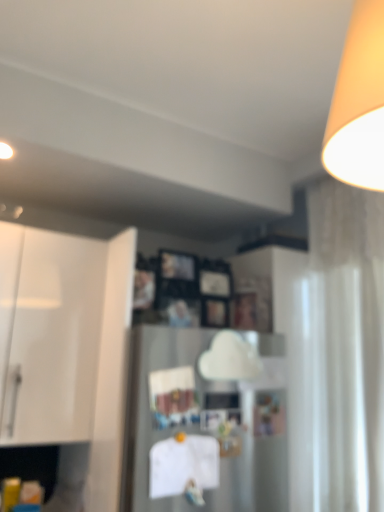
Question: From the image's perspective, is white sheer curtain at right on top of satin silver refrigerator at center?

Choices:
 (A) no
 (B) yes

Answer: (B)

Question: Is the depth of white sheer curtain at right less than that of satin silver refrigerator at center?

Choices:
 (A) no
 (B) yes

Answer: (A)

Question: Does white sheer curtain at right come behind satin silver refrigerator at center?

Choices:
 (A) yes
 (B) no

Answer: (A)

Question: From the image's perspective, is white sheer curtain at right beneath satin silver refrigerator at center?

Choices:
 (A) yes
 (B) no

Answer: (B)

Question: Is white sheer curtain at right looking in the opposite direction of satin silver refrigerator at center?

Choices:
 (A) no
 (B) yes

Answer: (A)

Question: Is white sheer curtain at right facing towards satin silver refrigerator at center?

Choices:
 (A) yes
 (B) no

Answer: (A)

Question: Can you confirm if white sheer curtain at right is wider than white glossy cabinet at left?

Choices:
 (A) no
 (B) yes

Answer: (A)

Question: Is white sheer curtain at right oriented away from white glossy cabinet at left?

Choices:
 (A) yes
 (B) no

Answer: (B)

Question: Is white sheer curtain at right at the left side of white glossy cabinet at left?

Choices:
 (A) no
 (B) yes

Answer: (A)

Question: Is white sheer curtain at right outside white glossy cabinet at left?

Choices:
 (A) yes
 (B) no

Answer: (A)

Question: Does white sheer curtain at right have a smaller size compared to white glossy cabinet at left?

Choices:
 (A) yes
 (B) no

Answer: (A)

Question: From the image's perspective, is white sheer curtain at right on white glossy cabinet at left?

Choices:
 (A) yes
 (B) no

Answer: (B)

Question: Is satin silver refrigerator at center further to the viewer compared to white glossy cabinet at left?

Choices:
 (A) yes
 (B) no

Answer: (B)